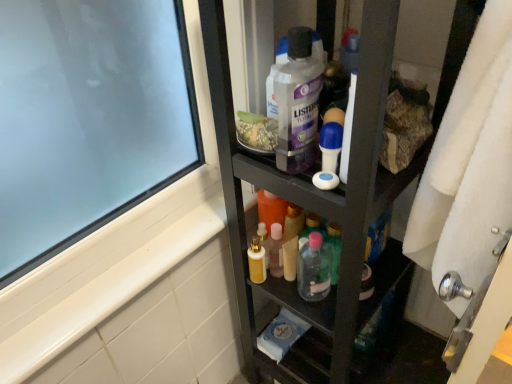
The image size is (512, 384). What are the coordinates of `white matte soap at center` in the screenshot? It's located at (325, 180).

Image resolution: width=512 pixels, height=384 pixels. In order to click on clear plastic mouthwash at center in this screenshot , I will do `click(298, 103)`.

Based on the photo, in order to face white fluffy bath towel at right, should I rotate leftwards or rightwards?

Rotate your view right by about 28.516°.

Identify the location of translucent plastic bottle at center, the first toiletry positioned from the bottom. This screenshot has height=384, width=512. (314, 269).

Where is `white matte soap at center`? The width and height of the screenshot is (512, 384). white matte soap at center is located at coordinates click(325, 180).

From the image's perspective, would you say white plastic roll-on deodorant at center, placed as the second toiletry when sorted from bottom to top, is positioned over white matte soap at center?

Yes, from the image's perspective, white plastic roll-on deodorant at center, placed as the second toiletry when sorted from bottom to top, is above white matte soap at center.

Which point is more distant from viewer, (330, 169) or (316, 181)?

The point (316, 181) is farther.

Looking at their sizes, would you say white plastic roll-on deodorant at center, the second toiletry when ordered from back to front, is wider or thinner than white matte soap at center?

Clearly, white plastic roll-on deodorant at center, the second toiletry when ordered from back to front, has more width compared to white matte soap at center.

Who is bigger, white matte soap at center or black matte cabinet at center?

black matte cabinet at center is bigger.

Is white matte soap at center located outside black matte cabinet at center?

No, white matte soap at center is inside or overlapping with black matte cabinet at center.

Considering the positions of objects white matte soap at center and translucent plastic bottle at center, which appears as the second toiletry when viewed from the top, in the image provided, who is more to the right, white matte soap at center or translucent plastic bottle at center, which appears as the second toiletry when viewed from the top,?

translucent plastic bottle at center, which appears as the second toiletry when viewed from the top.

Between white matte soap at center and translucent plastic bottle at center, the first toiletry positioned from the bottom, which one has larger size?

translucent plastic bottle at center, the first toiletry positioned from the bottom.

Considering the sizes of objects white matte soap at center and translucent plastic bottle at center, the second toiletry viewed from the front, in the image provided, who is shorter, white matte soap at center or translucent plastic bottle at center, the second toiletry viewed from the front,?

Standing shorter between the two is white matte soap at center.

Is white matte soap at center thinner than translucent plastic bottle at center, which appears as the second toiletry when viewed from the top?

Yes, white matte soap at center is thinner than translucent plastic bottle at center, which appears as the second toiletry when viewed from the top.

From a real-world perspective, is white fluffy bath towel at right above or below white matte soap at center?

From a real-world perspective, white fluffy bath towel at right is physically below white matte soap at center.

Relative to white matte soap at center, is white fluffy bath towel at right in front or behind?

white fluffy bath towel at right is positioned closer to the viewer than white matte soap at center.

In terms of size, does white fluffy bath towel at right appear bigger or smaller than white matte soap at center?

Clearly, white fluffy bath towel at right is larger in size than white matte soap at center.

Could you tell me if white fluffy bath towel at right is facing white matte soap at center?

Yes, white fluffy bath towel at right faces towards white matte soap at center.

The width and height of the screenshot is (512, 384). I want to click on toiletry above the white matte soap at center (from a real-world perspective), so click(330, 145).

Is white matte soap at center inside the boundaries of white plastic roll-on deodorant at center, placed as the second toiletry when sorted from bottom to top, or outside?

white matte soap at center lies outside white plastic roll-on deodorant at center, placed as the second toiletry when sorted from bottom to top.

From a real-world perspective, is white matte soap at center physically below white plastic roll-on deodorant at center, which appears as the 1th toiletry when viewed from the top?

Indeed, from a real-world perspective, white matte soap at center is positioned beneath white plastic roll-on deodorant at center, which appears as the 1th toiletry when viewed from the top.

Does white matte soap at center have a smaller size compared to white plastic roll-on deodorant at center, which appears as the 1th toiletry when viewed from the top?

Indeed, white matte soap at center has a smaller size compared to white plastic roll-on deodorant at center, which appears as the 1th toiletry when viewed from the top.

Is clear plastic mouthwash at center wider or thinner than white plastic roll-on deodorant at center, placed as the second toiletry when sorted from bottom to top?

Considering their sizes, clear plastic mouthwash at center looks broader than white plastic roll-on deodorant at center, placed as the second toiletry when sorted from bottom to top.

Is clear plastic mouthwash at center facing towards white plastic roll-on deodorant at center, which appears as the 1th toiletry when viewed from the top?

Yes.

Is translucent plastic bottle at center, acting as the first toiletry starting from the back, turned away from white fluffy bath towel at right?

No, translucent plastic bottle at center, acting as the first toiletry starting from the back, is not facing away from white fluffy bath towel at right.

Between translucent plastic bottle at center, which appears as the second toiletry when viewed from the top, and white fluffy bath towel at right, which one has less height?

translucent plastic bottle at center, which appears as the second toiletry when viewed from the top, is shorter.

Is translucent plastic bottle at center, which appears as the second toiletry when viewed from the top, thinner than white fluffy bath towel at right?

No, translucent plastic bottle at center, which appears as the second toiletry when viewed from the top, is not thinner than white fluffy bath towel at right.

From the image's perspective, which object appears higher, translucent plastic bottle at center, the first toiletry positioned from the bottom, or white fluffy bath towel at right?

translucent plastic bottle at center, the first toiletry positioned from the bottom, appears higher in the image.

Where is `toiletry that is the 2nd object to the right of the white matte soap at center, starting at the anchor`? This screenshot has height=384, width=512. toiletry that is the 2nd object to the right of the white matte soap at center, starting at the anchor is located at coordinates (330, 145).

I want to click on soap to the left of black matte cabinet at center, so click(325, 180).

Which object lies nearer to the anchor point white matte soap at center, white fluffy bath towel at right or clear plastic mouthwash at center?

clear plastic mouthwash at center.

From the image, which object appears to be nearer to white fluffy bath towel at right, white plastic roll-on deodorant at center, the second toiletry when ordered from back to front, or clear plastic mouthwash at center?

white plastic roll-on deodorant at center, the second toiletry when ordered from back to front, lies closer to white fluffy bath towel at right than the other object.

From the image, which object appears to be farther from translucent plastic bottle at center, the second toiletry viewed from the front, white matte soap at center or white plastic roll-on deodorant at center, the second toiletry when ordered from back to front?

white plastic roll-on deodorant at center, the second toiletry when ordered from back to front, lies further to translucent plastic bottle at center, the second toiletry viewed from the front, than the other object.

Considering their positions, is white plastic roll-on deodorant at center, which appears as the 1th toiletry when viewed from the top, positioned closer to translucent plastic bottle at center, which appears as the second toiletry when viewed from the top, than white matte soap at center?

white matte soap at center lies closer to translucent plastic bottle at center, which appears as the second toiletry when viewed from the top, than the other object.

Looking at the image, which one is located further to white fluffy bath towel at right, white matte soap at center or white plastic roll-on deodorant at center, the second toiletry when ordered from back to front?

The object further to white fluffy bath towel at right is white matte soap at center.

Based on the photo, looking at the image, which one is located closer to black matte cabinet at center, white fluffy bath towel at right or translucent plastic bottle at center, which appears as the second toiletry when viewed from the top?

translucent plastic bottle at center, which appears as the second toiletry when viewed from the top, is positioned closer to the anchor black matte cabinet at center.

Which object lies further to the anchor point clear plastic mouthwash at center, translucent plastic bottle at center, acting as the first toiletry starting from the back, or black matte cabinet at center?

translucent plastic bottle at center, acting as the first toiletry starting from the back, is positioned further to the anchor clear plastic mouthwash at center.

Based on their spatial positions, is white fluffy bath towel at right or translucent plastic bottle at center, acting as the first toiletry starting from the back, closer to white plastic roll-on deodorant at center, which appears as the 1th toiletry when viewed from the top?

Among the two, white fluffy bath towel at right is located nearer to white plastic roll-on deodorant at center, which appears as the 1th toiletry when viewed from the top.

The width and height of the screenshot is (512, 384). Identify the location of toiletry between clear plastic mouthwash at center and black matte cabinet at center from top to bottom. (330, 145).

You are a GUI agent. You are given a task and a screenshot of the screen. Output one action in this format:
    pyautogui.click(x=<x>, y=<y>)
    Task: Click on the cabinet positioned between white fluffy bath towel at right and white matte soap at center from near to far
    The image size is (512, 384).
    Given the screenshot: What is the action you would take?
    pyautogui.click(x=325, y=216)

At what (x,y) coordinates should I click in order to perform the action: click on soap between clear plastic mouthwash at center and translucent plastic bottle at center, which appears as the second toiletry when viewed from the top, in the up-down direction. Please return your answer as a coordinate pair (x, y). Looking at the image, I should click on (325, 180).

You are a GUI agent. You are given a task and a screenshot of the screen. Output one action in this format:
    pyautogui.click(x=<x>, y=<y>)
    Task: Click on the soap that lies between white plastic roll-on deodorant at center, the second toiletry when ordered from back to front, and translucent plastic bottle at center, the second toiletry viewed from the front, from top to bottom
    The height and width of the screenshot is (384, 512).
    Given the screenshot: What is the action you would take?
    pyautogui.click(x=325, y=180)